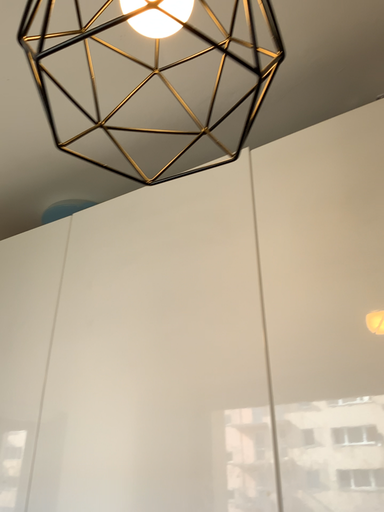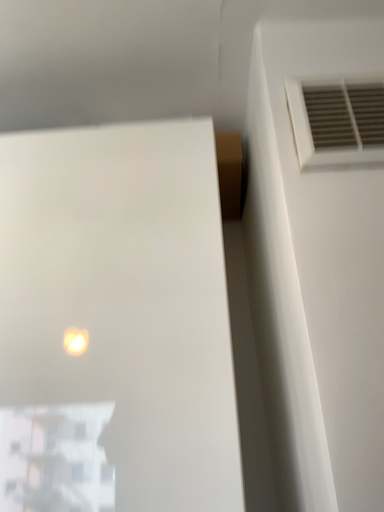
Question: How did the camera likely rotate when shooting the video?

Choices:
 (A) rotated left
 (B) rotated right

Answer: (B)